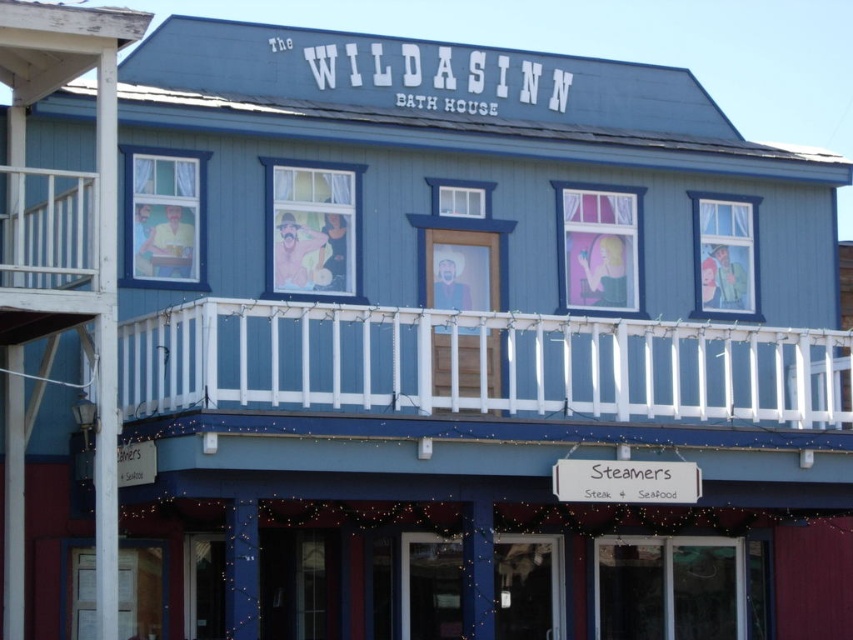
Question: Is white painted wood at upper center further to camera compared to white wooden railing at upper left?

Choices:
 (A) no
 (B) yes

Answer: (B)

Question: Can you confirm if white painted wood at upper center is bigger than white wooden railing at upper left?

Choices:
 (A) yes
 (B) no

Answer: (A)

Question: Which point appears closest to the camera in this image?

Choices:
 (A) (7, 211)
 (B) (635, 403)

Answer: (A)

Question: Does white painted wood at upper center appear over white wooden railing at upper left?

Choices:
 (A) no
 (B) yes

Answer: (A)

Question: Which object appears closest to the camera in this image?

Choices:
 (A) white wooden railing at upper left
 (B) white painted wood at upper center

Answer: (A)